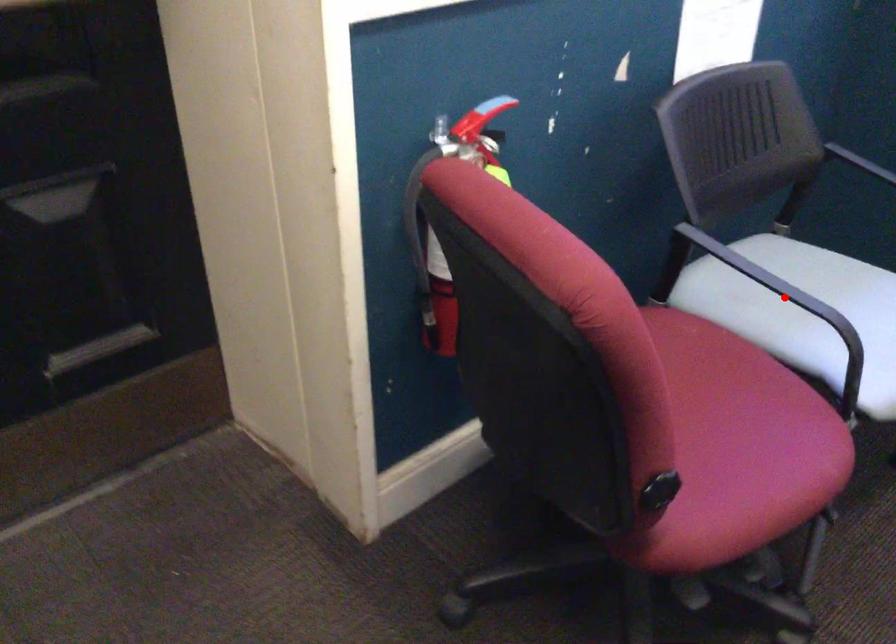
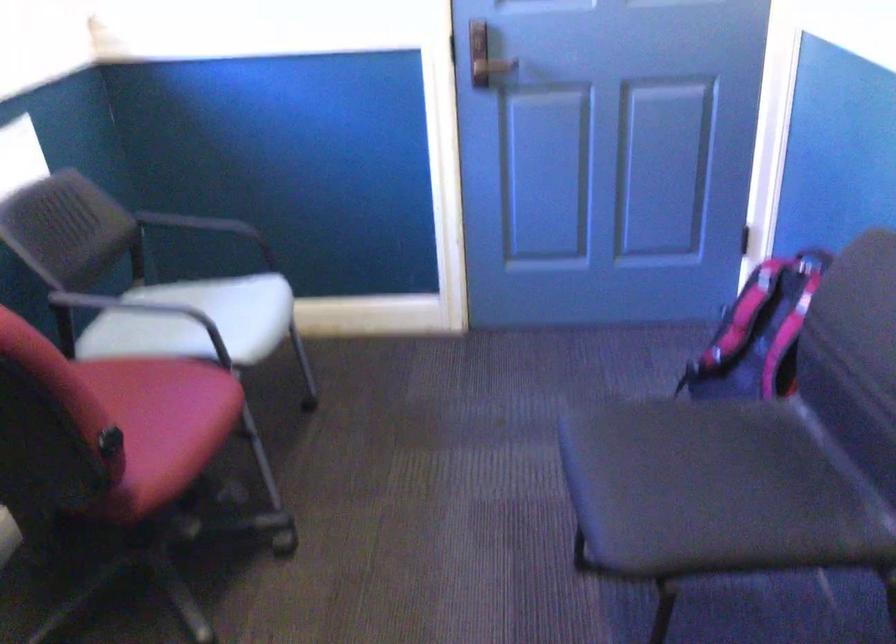
Question: I am providing you with two images of the same scene from different viewpoints. A red point is marked on the first image. Is the red point's position out of view in image 2?

Choices:
 (A) Yes
 (B) No

Answer: (A)